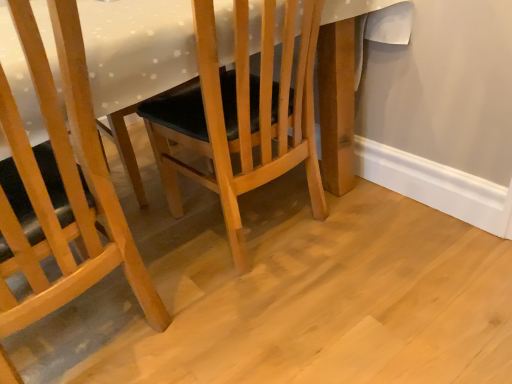
Question: Is white glossy table at center located outside matte wood chair at center, marked as the first chair in a left-to-right arrangement?

Choices:
 (A) no
 (B) yes

Answer: (B)

Question: Are white glossy table at center and matte wood chair at center, the second chair in the right-to-left sequence, making contact?

Choices:
 (A) no
 (B) yes

Answer: (A)

Question: Is white glossy table at center further to the viewer compared to matte wood chair at center, marked as the first chair in a left-to-right arrangement?

Choices:
 (A) yes
 (B) no

Answer: (A)

Question: Is white glossy table at center wider than matte wood chair at center, marked as the first chair in a left-to-right arrangement?

Choices:
 (A) no
 (B) yes

Answer: (B)

Question: Considering the relative sizes of white glossy table at center and matte wood chair at center, the second chair in the right-to-left sequence, in the image provided, is white glossy table at center taller than matte wood chair at center, the second chair in the right-to-left sequence,?

Choices:
 (A) no
 (B) yes

Answer: (A)

Question: Is white glossy table at center closer to the viewer compared to matte wood chair at center, the second chair in the right-to-left sequence?

Choices:
 (A) yes
 (B) no

Answer: (B)

Question: Does wooden chair at center, which is counted as the 2th chair, starting from the left, have a greater width compared to white glossy table at center?

Choices:
 (A) no
 (B) yes

Answer: (A)

Question: Considering the relative positions of wooden chair at center, which is the first chair from right to left, and white glossy table at center in the image provided, is wooden chair at center, which is the first chair from right to left, behind white glossy table at center?

Choices:
 (A) no
 (B) yes

Answer: (B)

Question: Considering the relative positions of wooden chair at center, which is the first chair from right to left, and white glossy table at center in the image provided, is wooden chair at center, which is the first chair from right to left, to the left of white glossy table at center from the viewer's perspective?

Choices:
 (A) no
 (B) yes

Answer: (A)

Question: Does wooden chair at center, which is the first chair from right to left, have a lesser width compared to white glossy table at center?

Choices:
 (A) no
 (B) yes

Answer: (B)

Question: From the image's perspective, is wooden chair at center, which is counted as the 2th chair, starting from the left, under white glossy table at center?

Choices:
 (A) no
 (B) yes

Answer: (B)

Question: Can you confirm if wooden chair at center, which is counted as the 2th chair, starting from the left, is taller than white glossy table at center?

Choices:
 (A) yes
 (B) no

Answer: (A)

Question: Does matte wood chair at center, the second chair in the right-to-left sequence, come behind wooden chair at center, which is counted as the 2th chair, starting from the left?

Choices:
 (A) yes
 (B) no

Answer: (B)